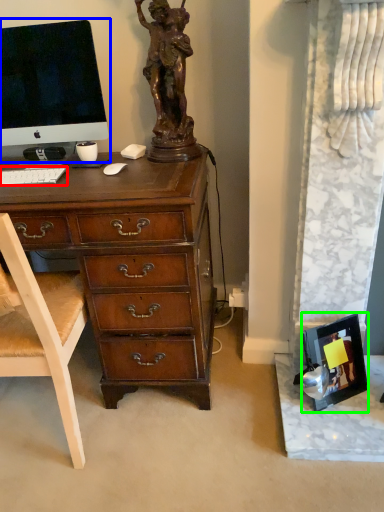
Question: Which object is the closest to the computer keyboard (highlighted by a red box)? Choose among these: computer monitor (highlighted by a blue box) or picture frame (highlighted by a green box).

Choices:
 (A) computer monitor
 (B) picture frame

Answer: (A)